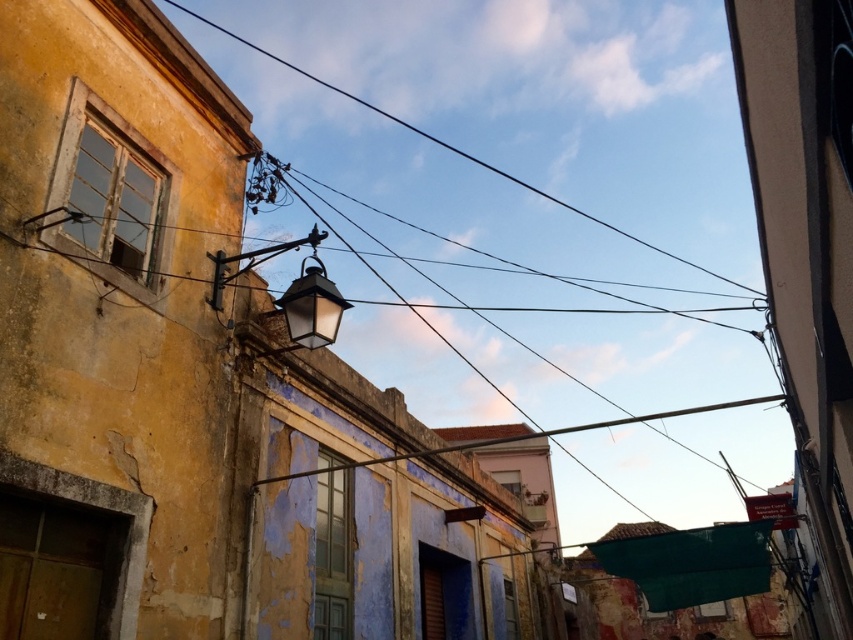
Is black wire at upper center wider than matte black lantern at center?

Correct, the width of black wire at upper center exceeds that of matte black lantern at center.

Describe the element at coordinates (514, 125) in the screenshot. I see `black wire at upper center` at that location.

This screenshot has width=853, height=640. What are the coordinates of `black wire at upper center` in the screenshot? It's located at (514, 125).